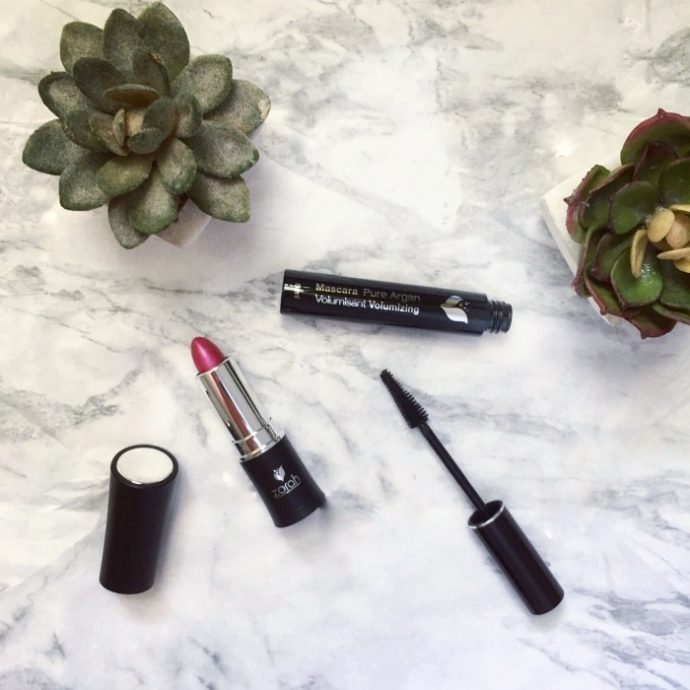
Where is `ceramic countertop`? Image resolution: width=690 pixels, height=690 pixels. ceramic countertop is located at coordinates [x=216, y=635].